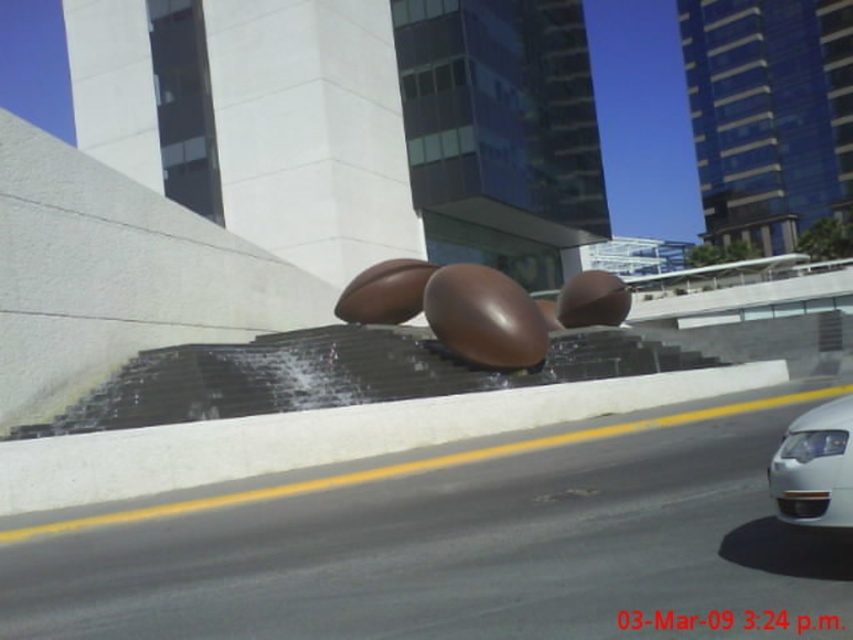
Question: Considering the relative positions of shiny brown eggs at center and white glossy car at right in the image provided, where is shiny brown eggs at center located with respect to white glossy car at right?

Choices:
 (A) below
 (B) above

Answer: (B)

Question: Does shiny brown eggs at center have a greater width compared to white glossy car at right?

Choices:
 (A) no
 (B) yes

Answer: (B)

Question: Is shiny brown eggs at center positioned behind white glossy car at right?

Choices:
 (A) yes
 (B) no

Answer: (A)

Question: Which of the following is the closest to the observer?

Choices:
 (A) (399, 282)
 (B) (842, 472)

Answer: (B)